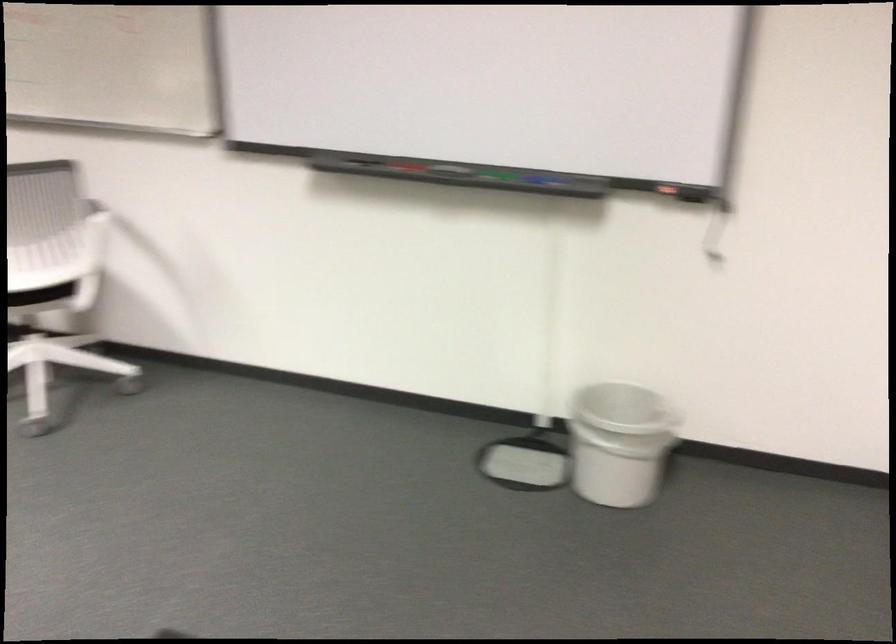
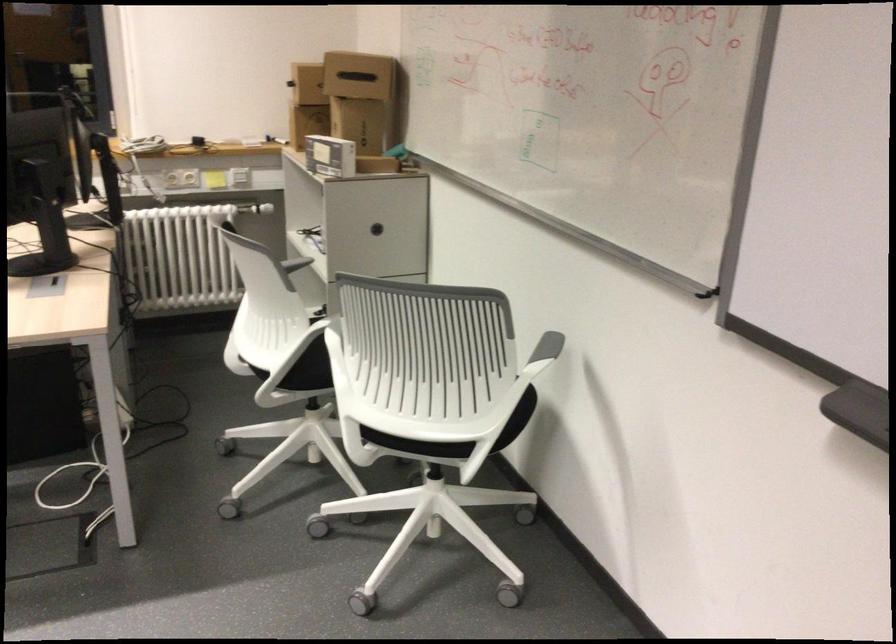
Where in the second image is the point corresponding to point (88, 214) from the first image?

(547, 346)